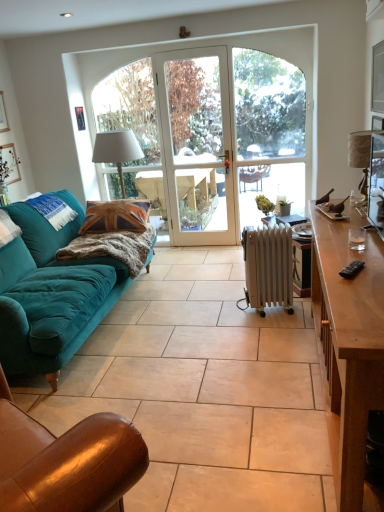
Question: Would you say brown leather chair at lower left is to the left or to the right of brown wooden desk at right in the picture?

Choices:
 (A) right
 (B) left

Answer: (B)

Question: Which is correct: brown leather chair at lower left is inside brown wooden desk at right, or outside of it?

Choices:
 (A) inside
 (B) outside

Answer: (B)

Question: Which object is positioned farthest from the white fabric lampshade at right, placed as the 1th lamp when sorted from right to left?

Choices:
 (A) clear glass door at center
 (B) brown wooden desk at right
 (C) white glass screen door at center
 (D) brown leather chair at lower left
 (E) velvet teal sofa at left

Answer: (C)

Question: Which object is the farthest from the white glass screen door at center?

Choices:
 (A) teal velvet pillow at left
 (B) white metallic radiator at center
 (C) brown wooden desk at right
 (D) brown leather chair at lower left
 (E) clear glass door at center

Answer: (D)